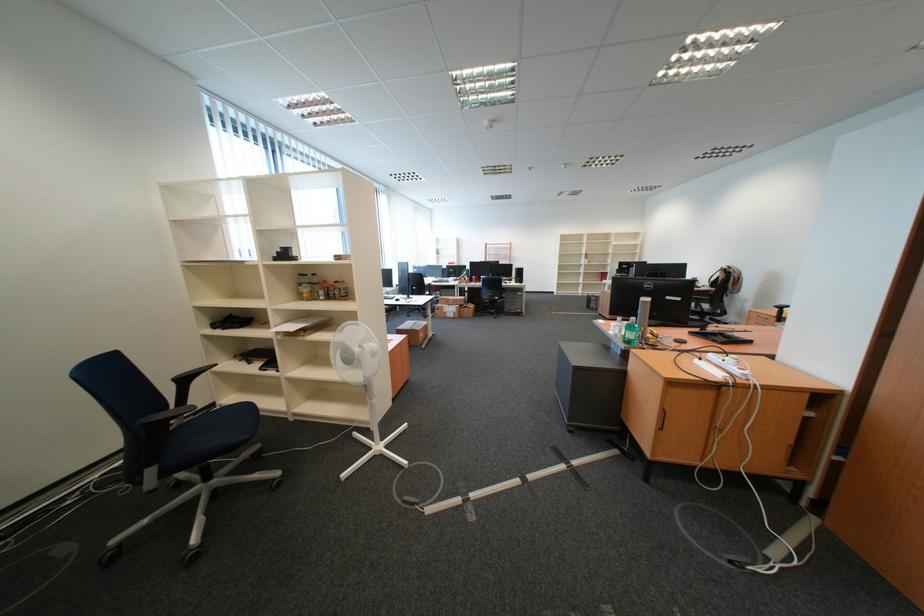
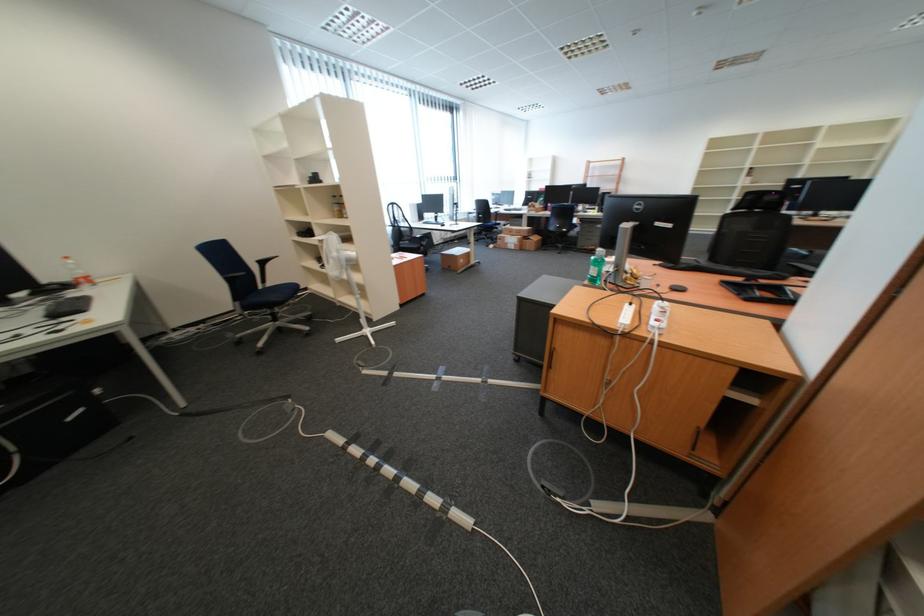
The point at (x=703, y=395) is marked in the first image. Where is the corresponding point in the second image?

(594, 338)